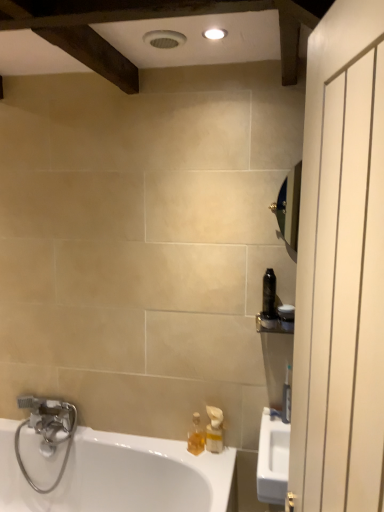
Question: Does white glossy bathtub at lower left appear on the right side of white plastic toothbrush at right, the 3th toiletry viewed from the top?

Choices:
 (A) no
 (B) yes

Answer: (A)

Question: Considering the relative sizes of white glossy bathtub at lower left and white plastic toothbrush at right, the first toiletry when ordered from bottom to top, in the image provided, is white glossy bathtub at lower left smaller than white plastic toothbrush at right, the first toiletry when ordered from bottom to top,?

Choices:
 (A) no
 (B) yes

Answer: (A)

Question: Is white glossy bathtub at lower left wider than white plastic toothbrush at right, the first toiletry when ordered from bottom to top?

Choices:
 (A) yes
 (B) no

Answer: (A)

Question: From the image's perspective, would you say white glossy bathtub at lower left is positioned over white plastic toothbrush at right, the first toiletry when ordered from bottom to top?

Choices:
 (A) yes
 (B) no

Answer: (B)

Question: Could white plastic toothbrush at right, the 3th toiletry viewed from the top, be considered to be inside white glossy bathtub at lower left?

Choices:
 (A) yes
 (B) no

Answer: (B)

Question: Looking at their shapes, would you say silver metallic faucet at lower left is wider or thinner than white plastic toothbrush at right, the first toiletry when ordered from bottom to top?

Choices:
 (A) wide
 (B) thin

Answer: (A)

Question: In terms of size, does silver metallic faucet at lower left appear bigger or smaller than white plastic toothbrush at right, the first toiletry when ordered from bottom to top?

Choices:
 (A) small
 (B) big

Answer: (B)

Question: Considering the positions of point (59, 422) and point (284, 411), is point (59, 422) closer or farther from the camera than point (284, 411)?

Choices:
 (A) farther
 (B) closer

Answer: (A)

Question: Visually, is silver metallic faucet at lower left positioned to the left or to the right of white plastic toothbrush at right, the first toiletry when ordered from bottom to top?

Choices:
 (A) left
 (B) right

Answer: (A)

Question: Relative to silver metallic faucet at lower left, is translucent plastic soap dispenser at lower center, which is the 2th soap dispenser from right to left, in front or behind?

Choices:
 (A) front
 (B) behind

Answer: (A)

Question: In terms of width, does translucent plastic soap dispenser at lower center, arranged as the first soap dispenser when viewed from the left, look wider or thinner when compared to silver metallic faucet at lower left?

Choices:
 (A) wide
 (B) thin

Answer: (B)

Question: From a real-world perspective, relative to silver metallic faucet at lower left, is translucent plastic soap dispenser at lower center, arranged as the first soap dispenser when viewed from the left, vertically above or below?

Choices:
 (A) below
 (B) above

Answer: (B)

Question: Do you think translucent plastic soap dispenser at lower center, which is the 2th soap dispenser from right to left, is within silver metallic faucet at lower left, or outside of it?

Choices:
 (A) outside
 (B) inside

Answer: (A)

Question: Based on their positions, is silver metallic faucet at lower left located to the left or right of black plastic bottle at right, acting as the 1th toiletry starting from the top?

Choices:
 (A) right
 (B) left

Answer: (B)

Question: Is point (74, 419) positioned closer to the camera than point (266, 311)?

Choices:
 (A) farther
 (B) closer

Answer: (A)